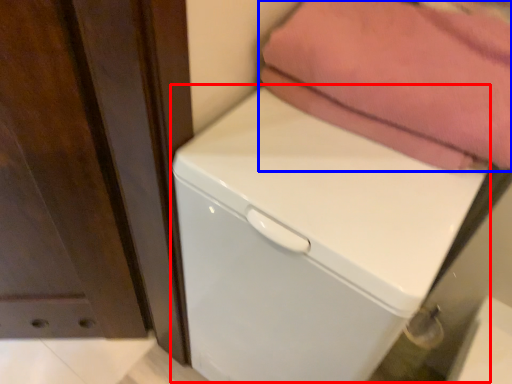
Question: Which of the following is the farthest to the observer, dish washer (highlighted by a red box) or towel (highlighted by a blue box)?

Choices:
 (A) dish washer
 (B) towel

Answer: (B)